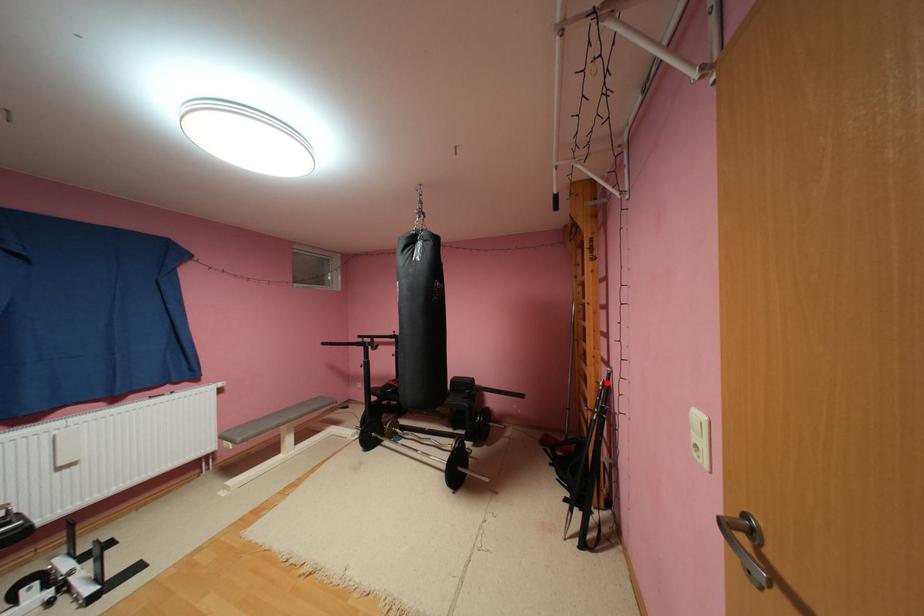
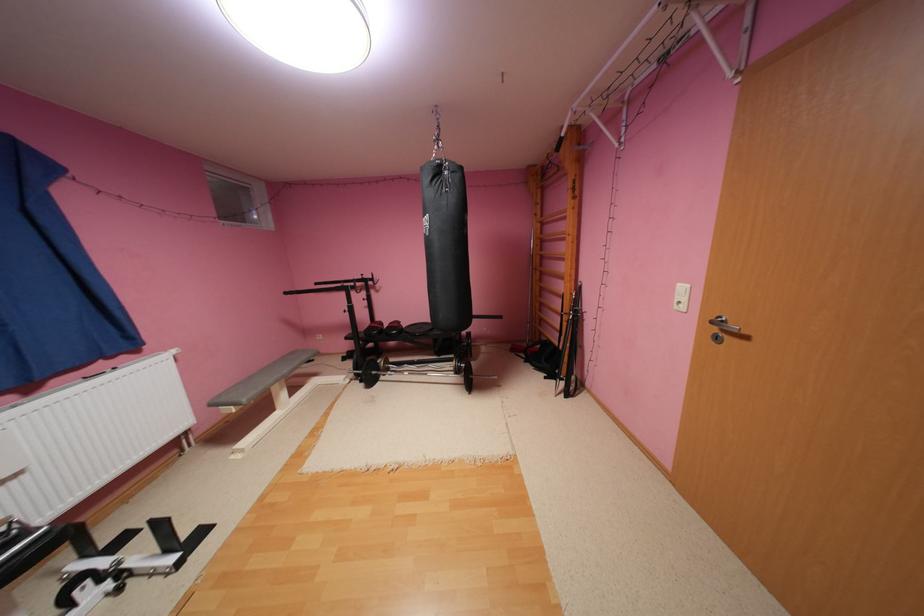
Question: I am providing you with two images of the same scene from different viewpoints. Image1 has a red point marked. In image2, the corresponding 3D location appears at what relative position? Reply with the corresponding letter.

Choices:
 (A) Closer
 (B) Farther

Answer: (A)